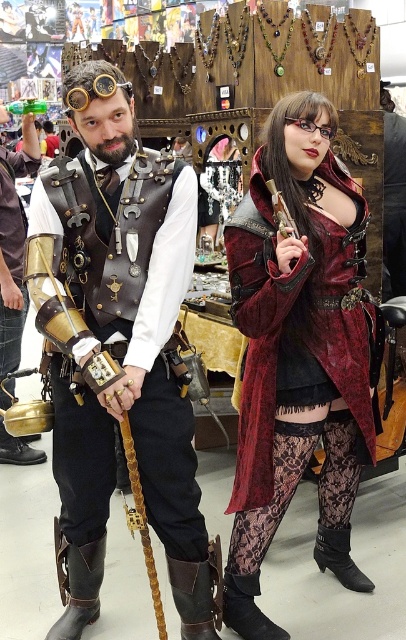
Can you confirm if velvet maroon coat at center is positioned below matte gold armor at left?

Yes.

Based on the photo, between velvet maroon coat at center and matte gold armor at left, which one appears on the left side from the viewer's perspective?

matte gold armor at left

Is point (317, 380) positioned before point (25, 458)?

Yes, it is in front of point (25, 458).

Locate an element on the screen. The image size is (406, 640). velvet maroon coat at center is located at coordinates (298, 342).

Does black leather boot at lower center have a larger size compared to black suede boot at lower right?

No.

Where is `black leather boot at lower center`? The image size is (406, 640). black leather boot at lower center is located at coordinates (246, 609).

Is velvet maroon coat at center above brown leather boot at lower left?

Indeed, velvet maroon coat at center is positioned over brown leather boot at lower left.

Is point (252, 388) in front of point (66, 570)?

That is True.

Identify the location of velvet maroon coat at center. The width and height of the screenshot is (406, 640). (298, 342).